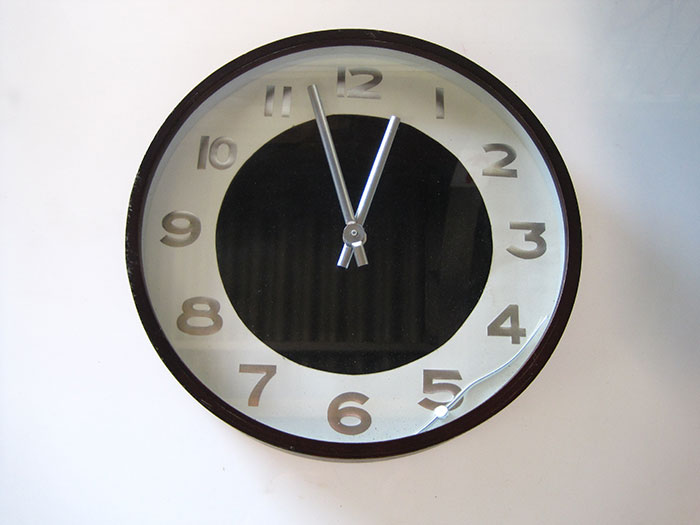
At what (x,y) coordinates should I click in order to perform the action: click on wire on clock. Please return your answer as a coordinate pair (x, y). The height and width of the screenshot is (525, 700). Looking at the image, I should click on (480, 380).